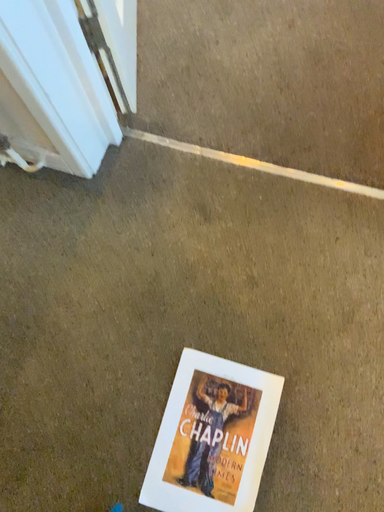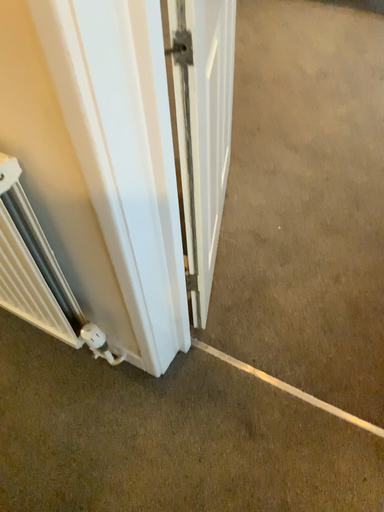
Question: Which way did the camera rotate in the video?

Choices:
 (A) rotated upward
 (B) rotated downward

Answer: (A)